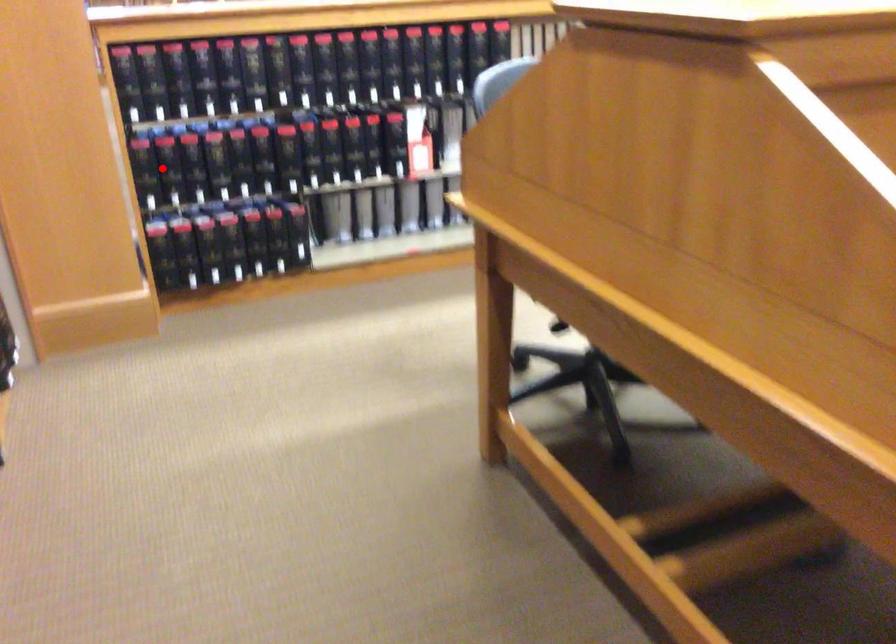
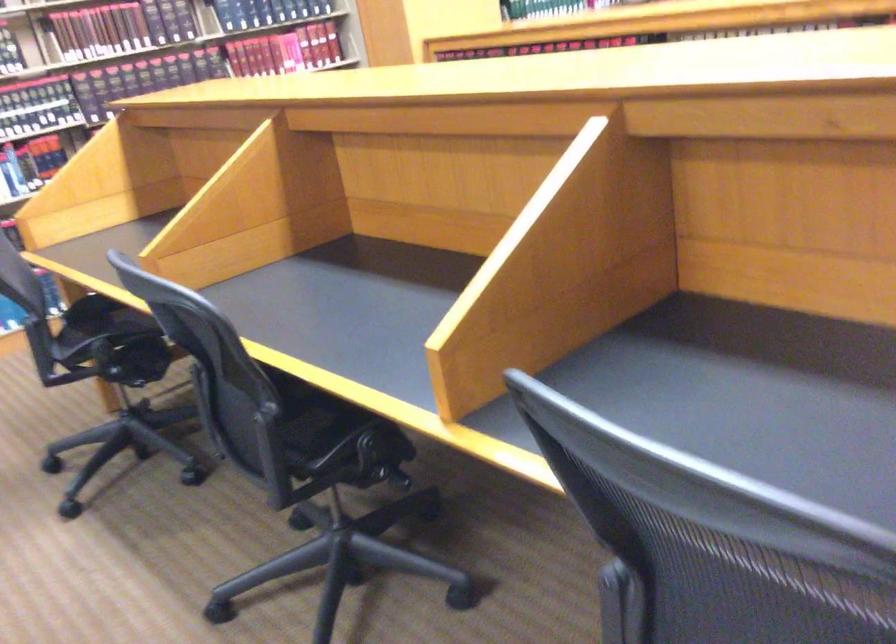
Question: I am providing you with two images of the same scene from different viewpoints. A red point is marked on the first image. Can you still see the location of the red point in image 2?

Choices:
 (A) Yes
 (B) No

Answer: (B)